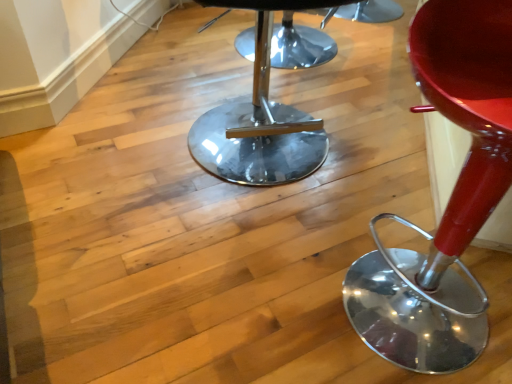
You are a GUI agent. You are given a task and a screenshot of the screen. Output one action in this format:
    pyautogui.click(x=<x>, y=<y>)
    Task: Click on the polished chrome stool at center
    The height and width of the screenshot is (384, 512).
    Given the screenshot: What is the action you would take?
    pyautogui.click(x=260, y=118)

The width and height of the screenshot is (512, 384). Describe the element at coordinates (260, 118) in the screenshot. I see `polished chrome stool at center` at that location.

Locate an element on the screen. The width and height of the screenshot is (512, 384). glossy red stool at right is located at coordinates (450, 198).

What is the approximate width of glossy red stool at right?

The width of glossy red stool at right is 17.18 inches.

This screenshot has height=384, width=512. What do you see at coordinates (450, 198) in the screenshot?
I see `glossy red stool at right` at bounding box center [450, 198].

Locate an element on the screen. The width and height of the screenshot is (512, 384). polished chrome stool at center is located at coordinates pos(260,118).

Looking at this image, which object is positioned more to the right, polished chrome stool at center or glossy red stool at right?

Positioned to the right is glossy red stool at right.

Considering the positions of objects polished chrome stool at center and glossy red stool at right in the image provided, who is in front, polished chrome stool at center or glossy red stool at right?

glossy red stool at right.

Which is in front, point (265, 33) or point (465, 272)?

The point (465, 272) is in front.

From the image's perspective, is polished chrome stool at center on top of glossy red stool at right?

Correct, polished chrome stool at center appears higher than glossy red stool at right in the image.

From a real-world perspective, which object stands above the other?

glossy red stool at right is physically above.

Is polished chrome stool at center thinner than glossy red stool at right?

In fact, polished chrome stool at center might be wider than glossy red stool at right.

Who is taller, polished chrome stool at center or glossy red stool at right?

glossy red stool at right.

Between polished chrome stool at center and glossy red stool at right, which one has smaller size?

With smaller size is glossy red stool at right.

Is polished chrome stool at center completely or partially outside of glossy red stool at right?

Indeed, polished chrome stool at center is completely outside glossy red stool at right.

Consider the image. Is polished chrome stool at center touching glossy red stool at right?

No, polished chrome stool at center is not with glossy red stool at right.

Is polished chrome stool at center oriented towards glossy red stool at right?

Yes, polished chrome stool at center is facing glossy red stool at right.

Measure the distance from polished chrome stool at center to glossy red stool at right.

polished chrome stool at center and glossy red stool at right are 60.05 centimeters apart from each other.

Where is `chair above the polished chrome stool at center (from a real-world perspective)`? chair above the polished chrome stool at center (from a real-world perspective) is located at coordinates (450, 198).

Considering the relative positions of glossy red stool at right and polished chrome stool at center in the image provided, is glossy red stool at right to the left or to the right of polished chrome stool at center?

Based on their positions, glossy red stool at right is located to the right of polished chrome stool at center.

Is glossy red stool at right in front of or behind polished chrome stool at center in the image?

In the image, glossy red stool at right appears in front of polished chrome stool at center.

Considering the points (493, 67) and (320, 139), which point is in front, point (493, 67) or point (320, 139)?

Positioned in front is point (493, 67).

From the image's perspective, is glossy red stool at right below polished chrome stool at center?

Yes.

From a real-world perspective, is glossy red stool at right over polished chrome stool at center?

Result: Yes, from a real-world perspective, glossy red stool at right is above polished chrome stool at center.

Can you confirm if glossy red stool at right is wider than polished chrome stool at center?

In fact, glossy red stool at right might be narrower than polished chrome stool at center.

Can you confirm if glossy red stool at right is taller than polished chrome stool at center?

Indeed, glossy red stool at right has a greater height compared to polished chrome stool at center.

Between glossy red stool at right and polished chrome stool at center, which one has larger size?

polished chrome stool at center.

Do you think glossy red stool at right is within polished chrome stool at center, or outside of it?

The correct answer is: outside.

Is there a large distance between glossy red stool at right and polished chrome stool at center?

Answer: They are positioned close to each other.

Is polished chrome stool at center at the back of glossy red stool at right?

No, glossy red stool at right's orientation is not away from polished chrome stool at center.

Locate an element on the screen. The width and height of the screenshot is (512, 384). stool behind the glossy red stool at right is located at coordinates (260, 118).

This screenshot has height=384, width=512. I want to click on stool above the glossy red stool at right (from the image's perspective), so click(x=260, y=118).

What are the coordinates of `stool that is on the left side of glossy red stool at right` in the screenshot? It's located at tap(260, 118).